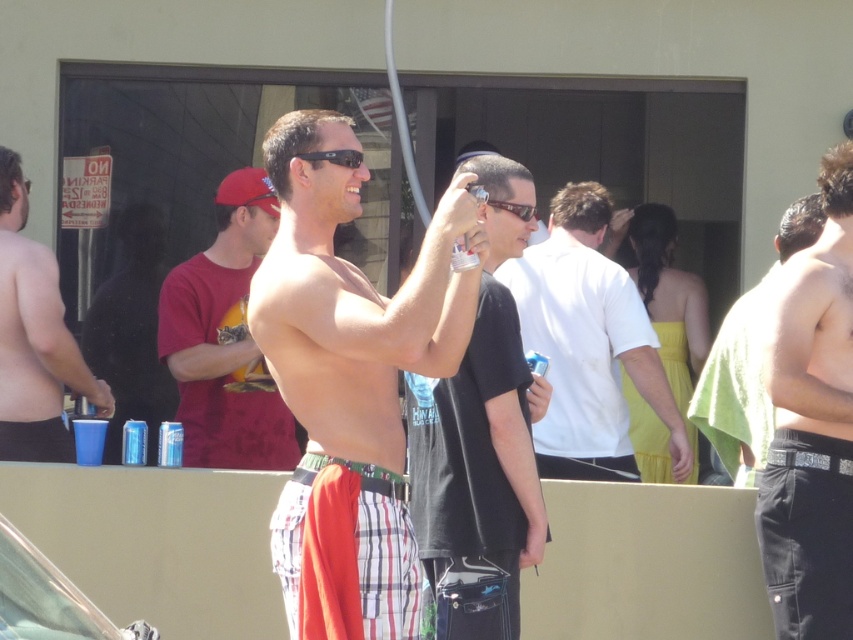
Does black leather pants at right have a lesser height compared to clear glass car at lower left?

Incorrect, black leather pants at right's height does not fall short of clear glass car at lower left's.

Can you confirm if black leather pants at right is positioned above clear glass car at lower left?

Yes.

Between point (820, 419) and point (45, 618), which one is positioned behind?

Point (820, 419)

You are a GUI agent. You are given a task and a screenshot of the screen. Output one action in this format:
    pyautogui.click(x=<x>, y=<y>)
    Task: Click on the black leather pants at right
    
    Given the screenshot: What is the action you would take?
    pyautogui.click(x=811, y=426)

Is white matte shirt at center positioned in front of clear glass car at lower left?

No, white matte shirt at center is behind clear glass car at lower left.

The height and width of the screenshot is (640, 853). Describe the element at coordinates (589, 337) in the screenshot. I see `white matte shirt at center` at that location.

At what (x,y) coordinates should I click in order to perform the action: click on white matte shirt at center. Please return your answer as a coordinate pair (x, y). The width and height of the screenshot is (853, 640). Looking at the image, I should click on (589, 337).

Between clear glass car at lower left and black plastic sunglasses at center, which one has less height?

black plastic sunglasses at center is shorter.

Is point (16, 532) positioned before point (357, 150)?

No, it is behind (357, 150).

At what (x,y) coordinates should I click in order to perform the action: click on clear glass car at lower left. Please return your answer as a coordinate pair (x, y). The height and width of the screenshot is (640, 853). Looking at the image, I should click on (48, 598).